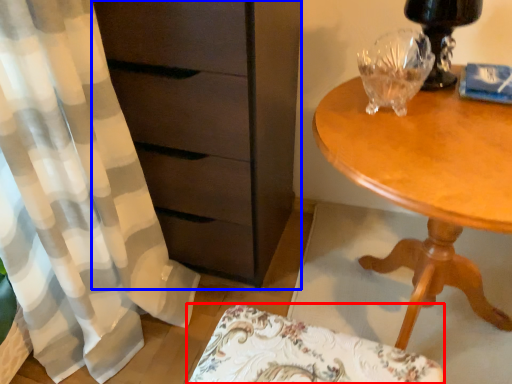
Question: Which object is further to the camera taking this photo, swivel chair (highlighted by a red box) or chest of drawers (highlighted by a blue box)?

Choices:
 (A) swivel chair
 (B) chest of drawers

Answer: (B)